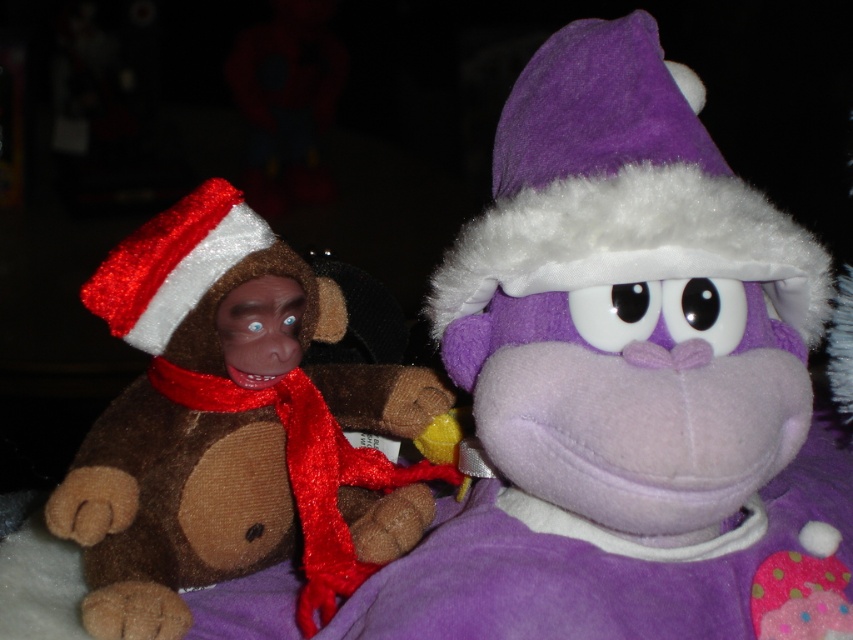
Question: Which of the following is the farthest from the observer?

Choices:
 (A) (334, 557)
 (B) (577, 202)
 (C) (654, 451)

Answer: (A)

Question: Is purple felt santa hat at upper center above red satin scarf at left?

Choices:
 (A) yes
 (B) no

Answer: (A)

Question: Can you confirm if brown plush monkey at left is wider than purple felt santa hat at upper center?

Choices:
 (A) yes
 (B) no

Answer: (B)

Question: Which point is closer to the camera?

Choices:
 (A) (225, 268)
 (B) (294, 481)

Answer: (A)

Question: Is brown plush monkey at left smaller than red satin scarf at left?

Choices:
 (A) no
 (B) yes

Answer: (A)

Question: Which object appears closest to the camera in this image?

Choices:
 (A) purple plush monkey at center
 (B) purple felt santa hat at upper center

Answer: (A)